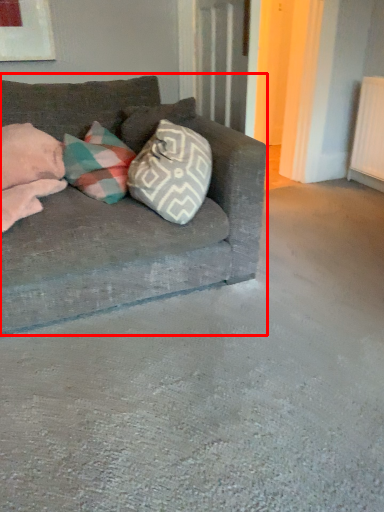
Question: Considering the relative positions of studio couch (annotated by the red box) and pillow in the image provided, where is studio couch (annotated by the red box) located with respect to the staircase?

Choices:
 (A) right
 (B) left

Answer: (A)